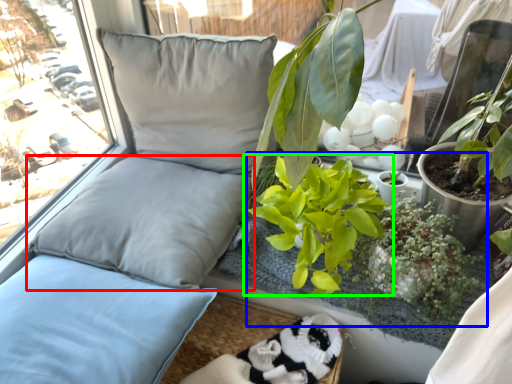
Question: Which object is positioned farthest from pillow (highlighted by a red box)? Select from floral arrangement (highlighted by a blue box) and houseplant (highlighted by a green box).

Choices:
 (A) floral arrangement
 (B) houseplant

Answer: (A)